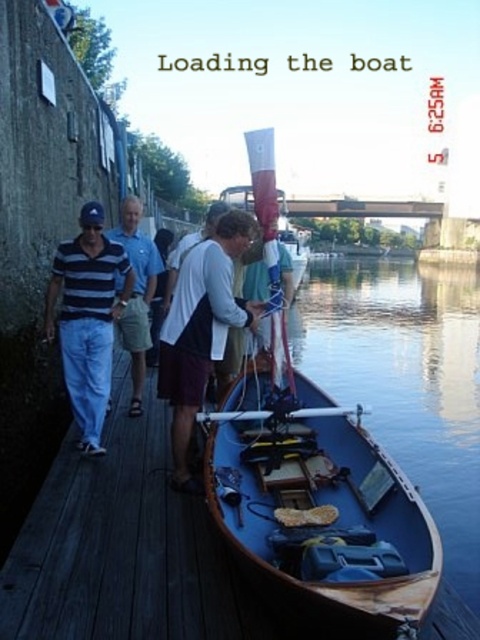
Question: Which point is closer to the camera taking this photo?

Choices:
 (A) (186, 436)
 (B) (47, 294)
 (C) (144, 244)
 (D) (277, 554)

Answer: (D)

Question: Does wooden boat at lower right have a lesser width compared to striped cotton shirt at left?

Choices:
 (A) yes
 (B) no

Answer: (B)

Question: Which point is closer to the camera?

Choices:
 (A) white cotton shirt at center
 (B) striped cotton shirt at left
 (C) dark blue wooden boat at center
 (D) striped cotton polo shirt at left

Answer: (C)

Question: Is wooden boat at lower right smaller than striped cotton shirt at left?

Choices:
 (A) no
 (B) yes

Answer: (A)

Question: Estimate the real-world distances between objects in this image. Which object is closer to the striped cotton polo shirt at left?

Choices:
 (A) white cotton shirt at center
 (B) wooden boat at lower right
 (C) dark blue wooden boat at center

Answer: (A)

Question: Does white cotton shirt at center appear over striped cotton polo shirt at left?

Choices:
 (A) no
 (B) yes

Answer: (A)